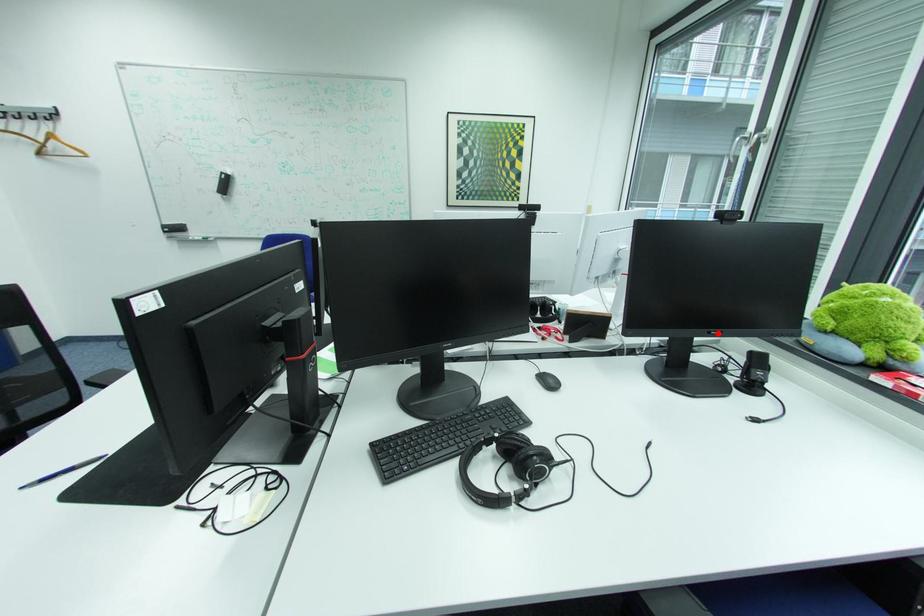
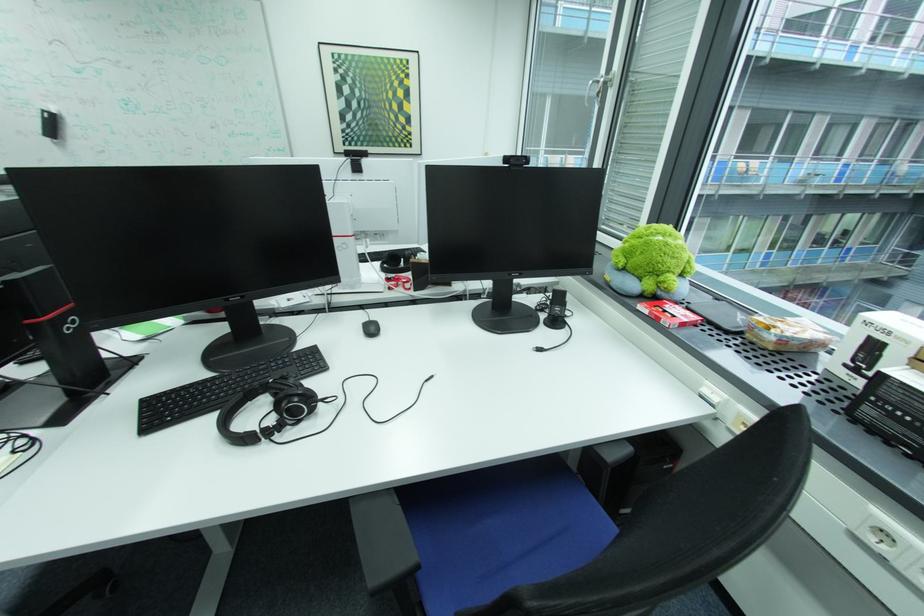
Locate, in the second image, the point that corresponds to the highlighted location in the first image.

(518, 275)